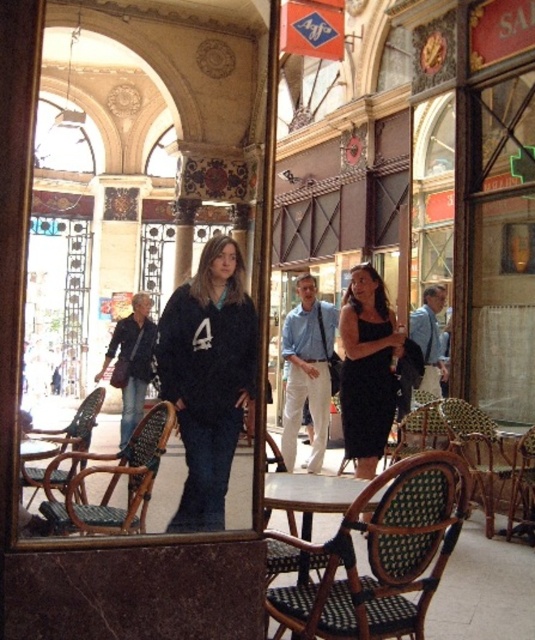
You are a delivery person who needs to place a package between the denim jacket at left and the woven wood chair at lower left. The package requires a space of 40 feet. Can you fit it there?

The denim jacket at left and woven wood chair at lower left are 42.21 feet apart from each other. Since the required space is 40 feet, the package can be placed there as the available space is sufficient.

You are standing in front of a large mirror in a well decorated cafe. You see a black matte sweatshirt at center reflected in the mirror. If you want to touch the actual sweatshirt, in which direction should you move relative to your current position in front of the mirror?

Since the black matte sweatshirt at center is reflected in the mirror, you should move directly towards the mirror to reach the actual sweatshirt, as reflections in mirrors are virtual images located behind the mirror. However, in reality, the actual sweatshirt would be in the physical space in front of the mirror where the person wearing it is standing. To reach it, you should move forward towards the mirror and then to the position where the reflection indicates, but considering the reflection reverses, a

You are standing in the cafe and want to sit down. The woven rattan chair at lower center is your target. Considering your height is 1.7 meters, can you comfortably reach the chair if you are 2 meters away from it?

The distance of woven rattan chair at lower center from camera is 23.21 meters, so you are 2 meters away from it. Since the chair is 23.21 meters away from the camera and you are only 2 meters away from it, you can comfortably reach the chair as the distance between you and the chair is manageable.